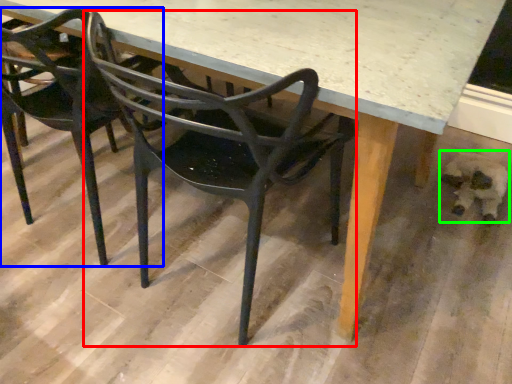
Question: Based on their relative distances, which object is nearer to chair (highlighted by a red box)? Choose from chair (highlighted by a blue box) and animal (highlighted by a green box).

Choices:
 (A) chair
 (B) animal

Answer: (A)